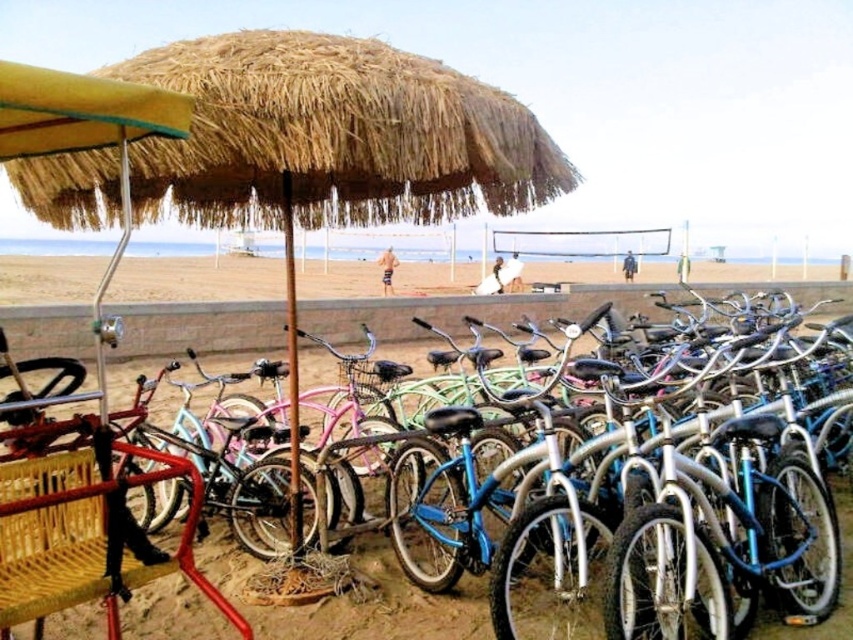
Is blue matte bicycle at center positioned in front of beige sand at center?

Yes, blue matte bicycle at center is closer to the viewer.

Who is lower down, blue matte bicycle at center or beige sand at center?

Positioned lower is blue matte bicycle at center.

Which is behind, point (643, 288) or point (444, 291)?

Point (444, 291)

You are a GUI agent. You are given a task and a screenshot of the screen. Output one action in this format:
    pyautogui.click(x=<x>, y=<y>)
    Task: Click on the blue matte bicycle at center
    
    Given the screenshot: What is the action you would take?
    pyautogui.click(x=355, y=600)

Who is shorter, straw at upper center or blue matte bicycle at center?

Standing shorter between the two is straw at upper center.

Is the position of straw at upper center less distant than that of blue matte bicycle at center?

Yes, straw at upper center is in front of blue matte bicycle at center.

At what (x,y) coordinates should I click in order to perform the action: click on straw at upper center. Please return your answer as a coordinate pair (x, y). The height and width of the screenshot is (640, 853). Looking at the image, I should click on (332, 140).

In order to click on straw at upper center in this screenshot , I will do `click(332, 140)`.

Describe the element at coordinates (332, 140) in the screenshot. I see `straw at upper center` at that location.

I want to click on straw at upper center, so click(332, 140).